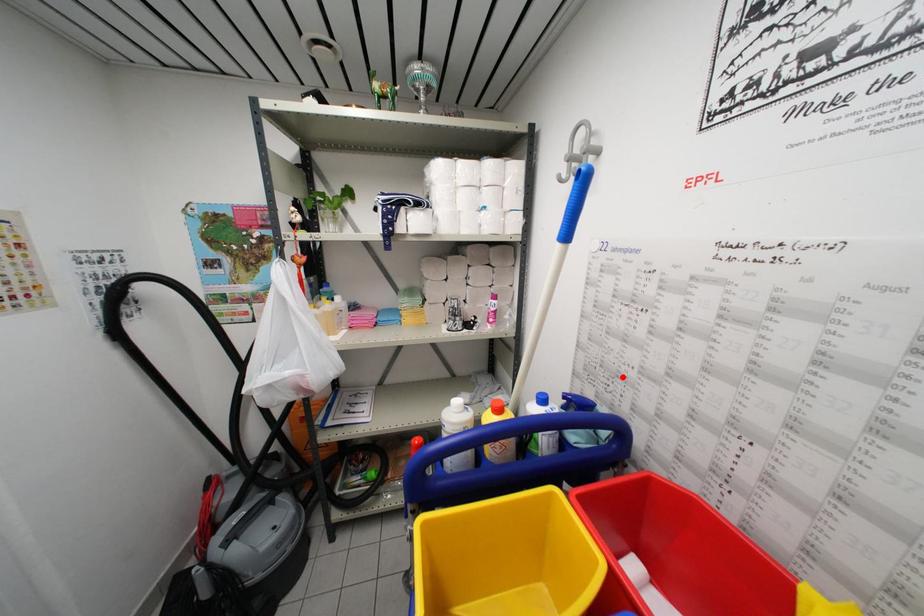
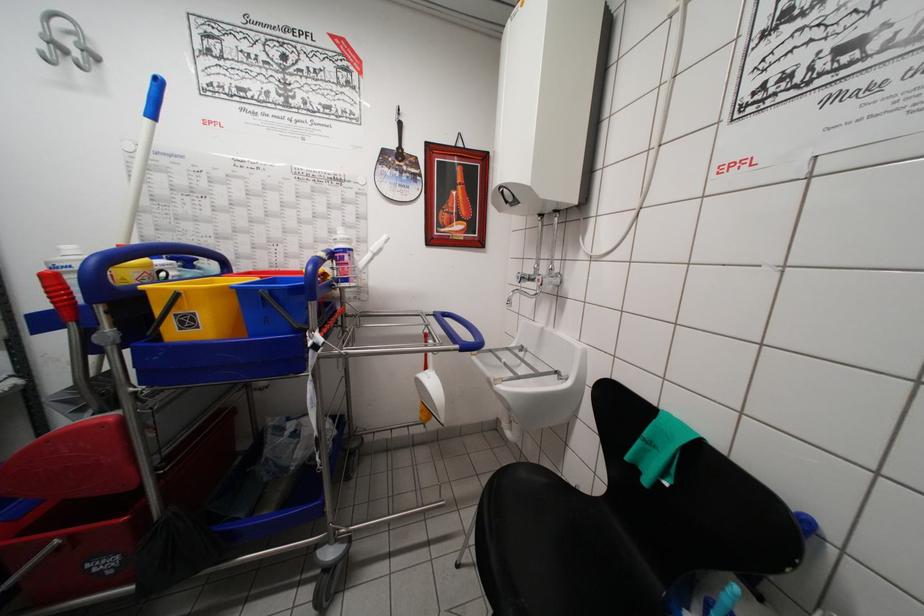
In the second image, find the point that corresponds to the highlighted location in the first image.

(203, 249)